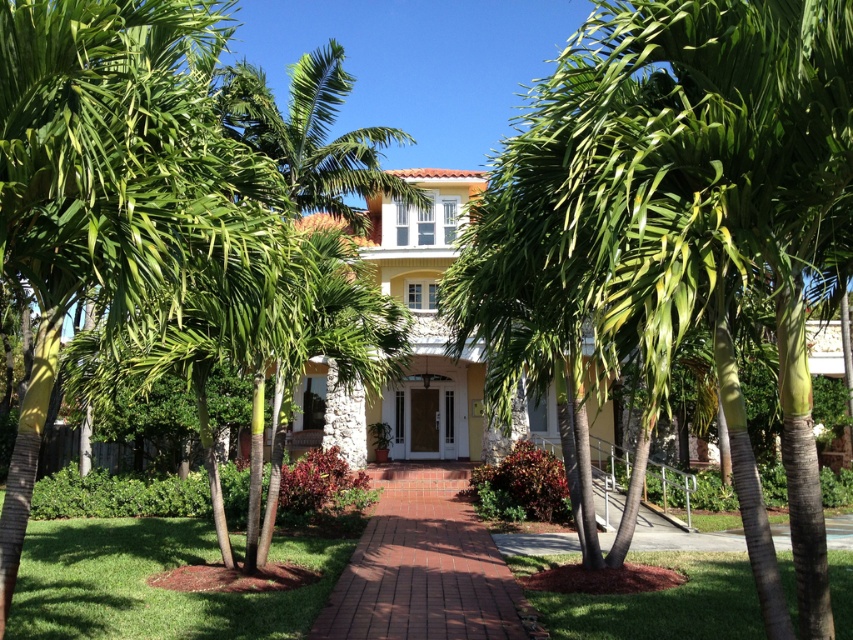
Question: Which point is closer to the camera?

Choices:
 (A) green leafy palm tree at left
 (B) brick pathway at center
 (C) green leafy palm tree at center

Answer: (C)

Question: Does green leafy palm tree at left appear on the right side of brick pathway at center?

Choices:
 (A) no
 (B) yes

Answer: (A)

Question: Which of the following is the farthest from the observer?

Choices:
 (A) green leafy palm tree at center
 (B) green leafy palm tree at left
 (C) brick pathway at center

Answer: (C)

Question: Which is farther from the green leafy palm tree at center?

Choices:
 (A) brick pathway at center
 (B) green leafy palm tree at left

Answer: (A)

Question: Is the position of green leafy palm tree at center more distant than that of green leafy palm tree at left?

Choices:
 (A) no
 (B) yes

Answer: (A)

Question: Does green leafy palm tree at center come in front of brick pathway at center?

Choices:
 (A) yes
 (B) no

Answer: (A)